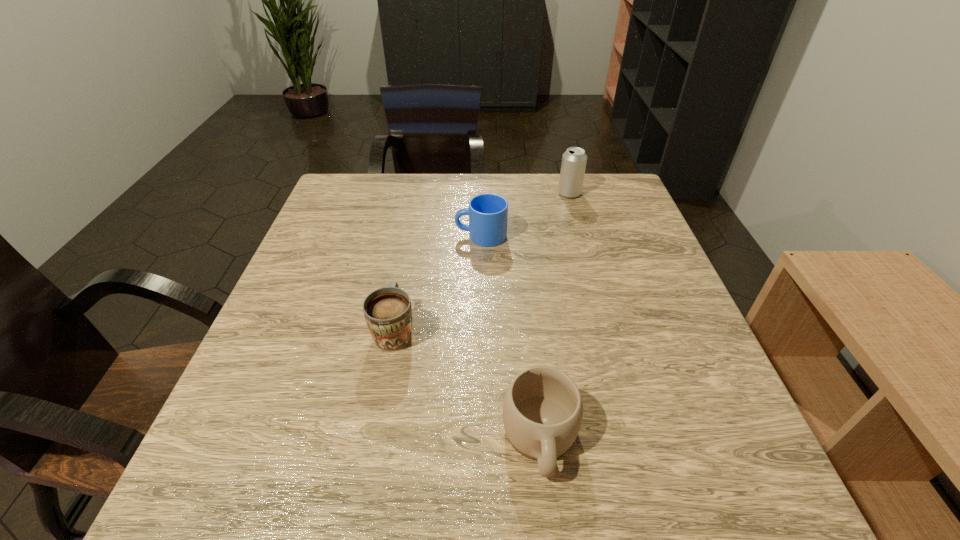
At what (x,y) coordinates should I click in order to perform the action: click on empty space between the leftmost object and the nearest object. Please return your answer as a coordinate pair (x, y). This screenshot has height=540, width=960. Looking at the image, I should click on (468, 384).

The width and height of the screenshot is (960, 540). I want to click on object that is the third nearest to the nearest object, so click(574, 160).

Choose which object is the nearest neighbor to the nearest object. Please provide its 2D coordinates. Your answer should be formatted as a tuple, i.e. [(x, y)], where the tuple contains the x and y coordinates of a point satisfying the conditions above.

[(388, 313)]

Image resolution: width=960 pixels, height=540 pixels. I want to click on mug that is the second closest one to the second farthest object, so click(x=542, y=411).

Image resolution: width=960 pixels, height=540 pixels. Identify the location of mug that stands as the closest to the second nearest mug. (542, 411).

This screenshot has height=540, width=960. Identify the location of free space that satisfies the following two spatial constraints: 1. on the side of the farthest object with the handle; 2. on the left side of the leftmost mug. (420, 193).

Where is `vacant space that satisfies the following two spatial constraints: 1. on the side of the farthest object with the handle; 2. on the right side of the second nearest object`? vacant space that satisfies the following two spatial constraints: 1. on the side of the farthest object with the handle; 2. on the right side of the second nearest object is located at coordinates (420, 193).